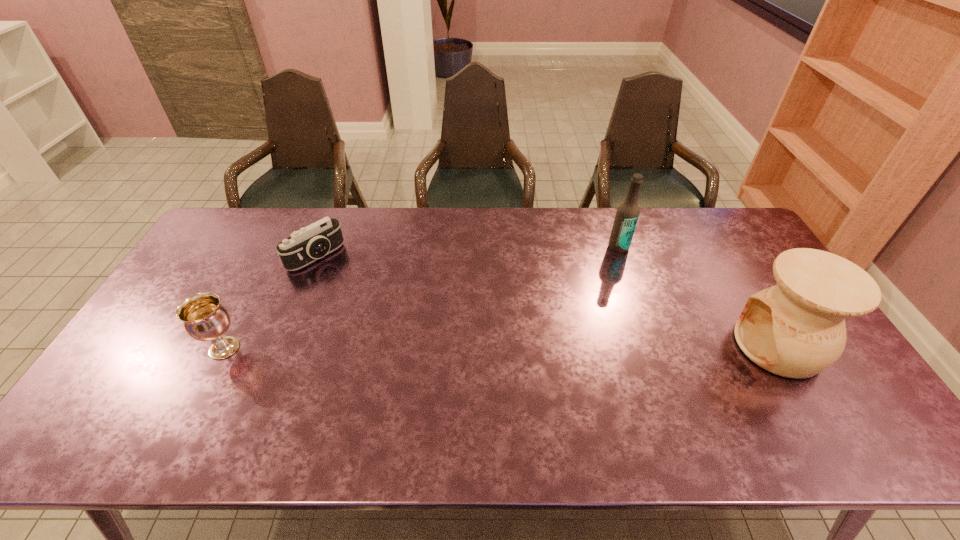
You are a GUI agent. You are given a task and a screenshot of the screen. Output one action in this format:
    pyautogui.click(x=<x>, y=<y>)
    Task: Click on the leftmost object
    The width and height of the screenshot is (960, 540).
    Given the screenshot: What is the action you would take?
    pyautogui.click(x=204, y=318)

Find the location of a particular element. Image resolution: width=960 pixels, height=540 pixels. the second shortest object is located at coordinates (204, 318).

Where is `the rightmost object`? the rightmost object is located at coordinates [x=796, y=329].

Where is `the second object from left to right`? Image resolution: width=960 pixels, height=540 pixels. the second object from left to right is located at coordinates (303, 247).

Where is `camera`? The width and height of the screenshot is (960, 540). camera is located at coordinates (303, 247).

At what (x,y) coordinates should I click in order to perform the action: click on the third object from left to right. Please return your answer as a coordinate pair (x, y). This screenshot has width=960, height=540. Looking at the image, I should click on (627, 214).

The height and width of the screenshot is (540, 960). Find the location of `free space located 0.330m on the right of the second shortest object`. free space located 0.330m on the right of the second shortest object is located at coordinates (365, 348).

Find the location of a particular element. free space located at the open side of the rightmost object is located at coordinates (600, 346).

Where is `vacant space located at the open side of the rightmost object`? vacant space located at the open side of the rightmost object is located at coordinates [604, 346].

The image size is (960, 540). Find the location of `vacant region located at the open side of the rightmost object`. vacant region located at the open side of the rightmost object is located at coordinates 710,346.